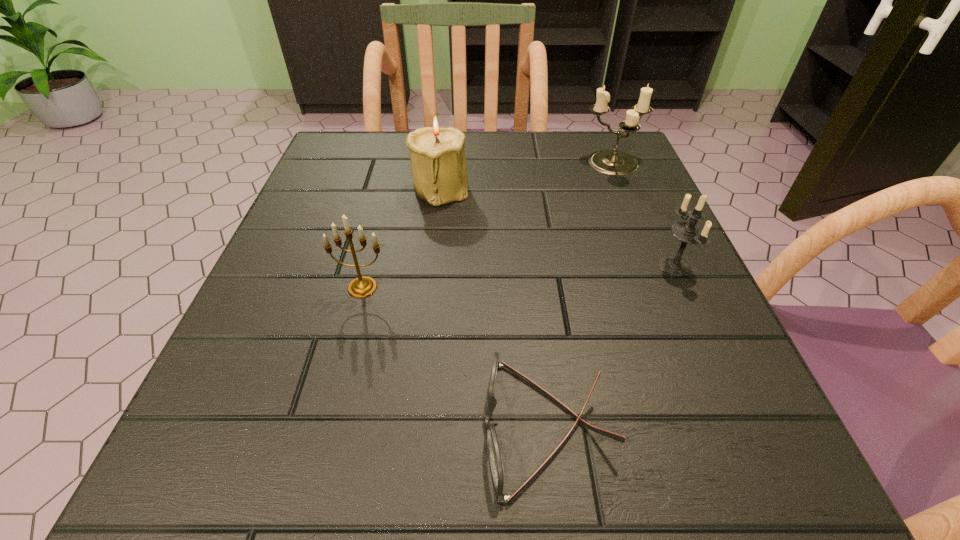
Where is `free spot between the third candle holder from right to left and the leftmost candle holder`? free spot between the third candle holder from right to left and the leftmost candle holder is located at coordinates (401, 238).

At what (x,y) coordinates should I click in order to perform the action: click on free space between the third candle holder from right to left and the spectacles. Please return your answer as a coordinate pair (x, y). Looking at the image, I should click on (494, 307).

This screenshot has height=540, width=960. Identify the location of object that is the third nearest to the nearest object. (438, 161).

At what (x,y) coordinates should I click in order to perform the action: click on the third closest object to the shortest object. Please return your answer as a coordinate pair (x, y). Looking at the image, I should click on (438, 161).

Identify which candle holder is the nearest to the fourth object from right to left. Please provide its 2D coordinates. Your answer should be formatted as a tuple, i.e. [(x, y)], where the tuple contains the x and y coordinates of a point satisfying the conditions above.

[(363, 286)]

Identify which candle holder is located as the fourth nearest to the nearest object. Please provide its 2D coordinates. Your answer should be formatted as a tuple, i.e. [(x, y)], where the tuple contains the x and y coordinates of a point satisfying the conditions above.

[(611, 162)]